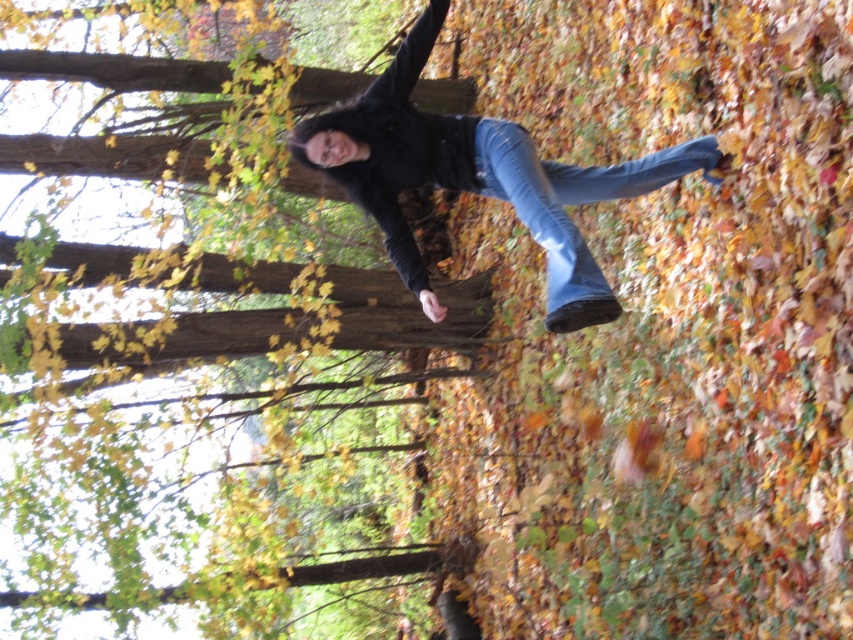
You are a photographer trying to capture the person in the scene. If you want to focus on the brown wood tree at center while keeping the denim jeans at center visible in the background, which direction should you move your camera?

You should move your camera to the left so that the brown wood tree at center becomes the focus while the denim jeans at center remains in the background to the right.

You are a photographer trying to capture a photo of the blue denim jeans at center and the brown wood tree at center. Which object should you focus on first if you want to ensure both are in the frame without moving the camera?

The blue denim jeans at center is bigger than the brown wood tree at center, so you should focus on the blue denim jeans at center first to ensure both fit in the frame.